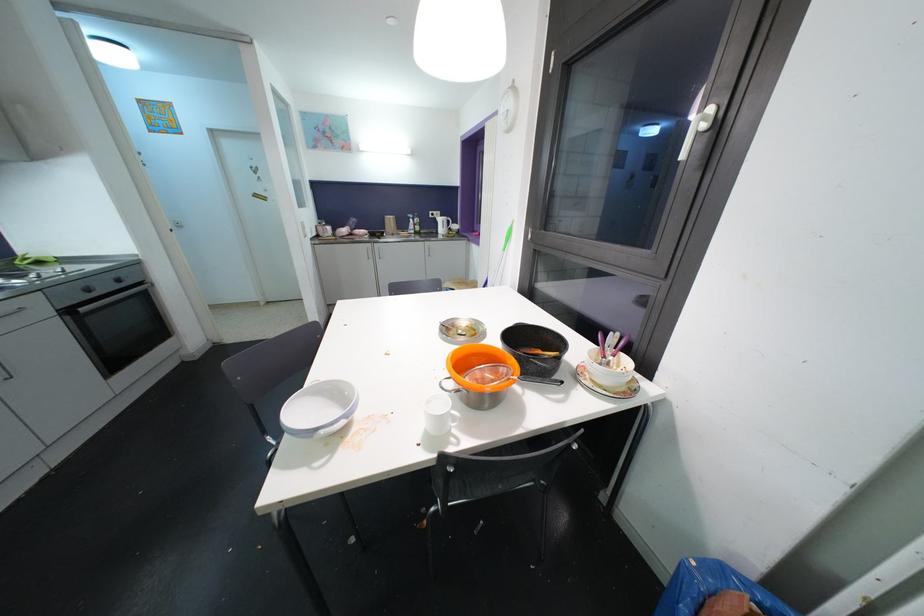
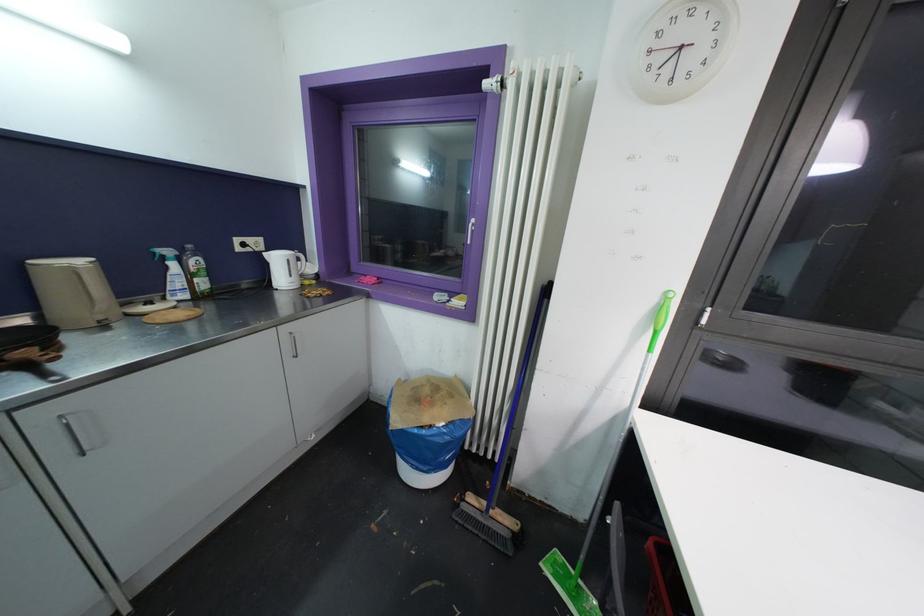
Find the pixel in the second image that matches point 415,223 in the first image.

(176, 267)